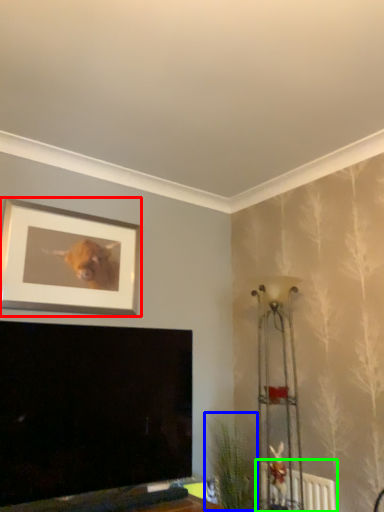
Question: Which object is the farthest from picture frame (highlighted by a red box)? Choose among these: plant (highlighted by a blue box) or radiator (highlighted by a green box).

Choices:
 (A) plant
 (B) radiator

Answer: (B)